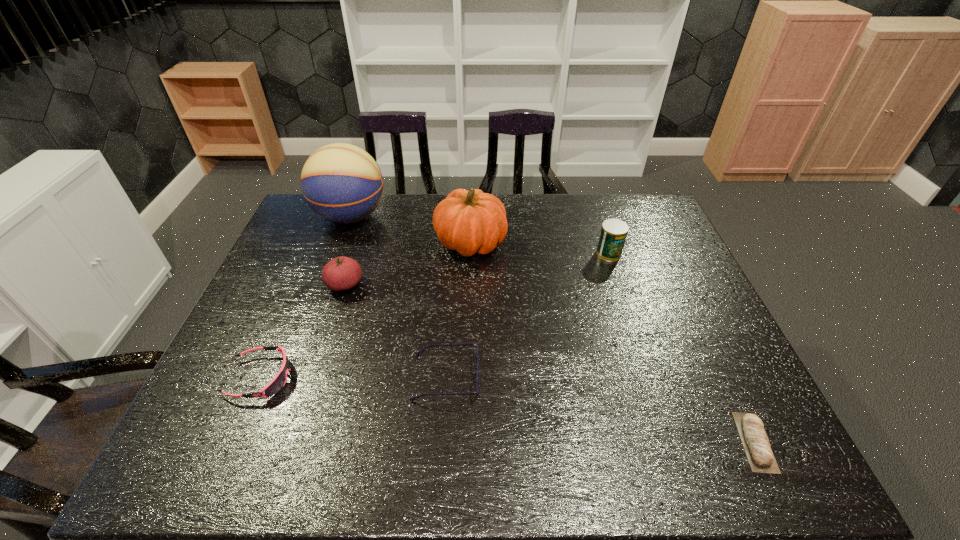
Where is `vacant space that is in between the fourth nearest object and the tallest object`? This screenshot has width=960, height=540. vacant space that is in between the fourth nearest object and the tallest object is located at coordinates (348, 251).

This screenshot has width=960, height=540. Identify the location of vacant area that lies between the fourth farthest object and the tallest object. (348, 251).

Locate an element on the screen. This screenshot has width=960, height=540. vacant point located between the tomato and the spectacles is located at coordinates (396, 332).

I want to click on free space between the fourth farthest object and the goggles, so click(302, 332).

Locate an element on the screen. The height and width of the screenshot is (540, 960). empty location between the can and the rightmost object is located at coordinates (682, 348).

Identify the location of vacant area between the goggles and the nearest object. (508, 410).

Identify which object is the sixth nearest to the fourth farthest object. Please provide its 2D coordinates. Your answer should be formatted as a tuple, i.e. [(x, y)], where the tuple contains the x and y coordinates of a point satisfying the conditions above.

[(756, 444)]

Where is `the second closest object to the tomato`? This screenshot has width=960, height=540. the second closest object to the tomato is located at coordinates (470, 222).

Find the location of `vacant region that satisfies the following two spatial constraints: 1. on the front side of the rightmost object; 2. on the right side of the pumpkin`. vacant region that satisfies the following two spatial constraints: 1. on the front side of the rightmost object; 2. on the right side of the pumpkin is located at coordinates (466, 442).

Where is `free space that satisfies the following two spatial constraints: 1. on the patterned surface of the second tallest object; 2. on the right side of the basketball`? The height and width of the screenshot is (540, 960). free space that satisfies the following two spatial constraints: 1. on the patterned surface of the second tallest object; 2. on the right side of the basketball is located at coordinates (341, 242).